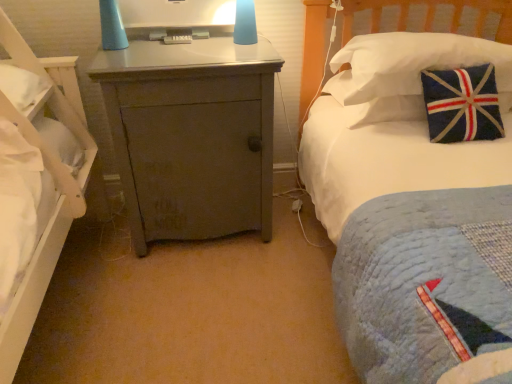
What is the approximate height of matte gray cabinet at center?

matte gray cabinet at center is 31.92 inches tall.

What do you see at coordinates (409, 63) in the screenshot? Image resolution: width=512 pixels, height=384 pixels. I see `white fabric pillow at upper right` at bounding box center [409, 63].

What are the coordinates of `matte plastic monitor at center` in the screenshot? It's located at (177, 18).

The height and width of the screenshot is (384, 512). Find the location of `matte gray cabinet at center`. matte gray cabinet at center is located at coordinates (192, 136).

Is matte plastic monitor at center inside or outside of white fabric pillow at upper right?

matte plastic monitor at center is not enclosed by white fabric pillow at upper right.

From the image's perspective, which is above, matte plastic monitor at center or white fabric pillow at upper right?

matte plastic monitor at center appears higher in the image.

Considering the relative sizes of matte plastic monitor at center and white fabric pillow at upper right in the image provided, is matte plastic monitor at center smaller than white fabric pillow at upper right?

Yes.

Considering the positions of point (185, 8) and point (499, 81), is point (185, 8) closer or farther from the camera than point (499, 81)?

Point (185, 8) is positioned farther from the camera compared to point (499, 81).

Is point (370, 54) behind point (190, 8)?

No.

Identify the location of pillow below the matte plastic monitor at center (from the image's perspective). (409, 63).

From a real-world perspective, is white fabric pillow at upper right under matte plastic monitor at center?

Yes, from a real-world perspective, white fabric pillow at upper right is beneath matte plastic monitor at center.

Is white fabric pillow at upper right completely or partially outside of matte plastic monitor at center?

Yes, white fabric pillow at upper right is outside of matte plastic monitor at center.

From the picture: Considering the relative sizes of matte plastic monitor at center and matte gray cabinet at center in the image provided, is matte plastic monitor at center shorter than matte gray cabinet at center?

Indeed, matte plastic monitor at center has a lesser height compared to matte gray cabinet at center.

Considering the sizes of matte plastic monitor at center and matte gray cabinet at center in the image, is matte plastic monitor at center bigger or smaller than matte gray cabinet at center?

matte plastic monitor at center is smaller than matte gray cabinet at center.

Is matte plastic monitor at center inside the boundaries of matte gray cabinet at center, or outside?

matte plastic monitor at center cannot be found inside matte gray cabinet at center.

Could you tell me if matte plastic monitor at center is turned towards matte gray cabinet at center?

No, matte plastic monitor at center is not oriented towards matte gray cabinet at center.

Is matte gray cabinet at center aimed at matte plastic monitor at center?

No, matte gray cabinet at center is not facing towards matte plastic monitor at center.

Which is behind, matte gray cabinet at center or matte plastic monitor at center?

Positioned behind is matte plastic monitor at center.

From the image's perspective, is matte gray cabinet at center above or below matte plastic monitor at center?

matte gray cabinet at center is below matte plastic monitor at center.

Considering the sizes of matte gray cabinet at center and matte plastic monitor at center in the image, is matte gray cabinet at center wider or thinner than matte plastic monitor at center?

matte gray cabinet at center is wider than matte plastic monitor at center.

Which is behind, white fabric pillow at upper right or matte gray cabinet at center?

Positioned behind is white fabric pillow at upper right.

From the image's perspective, which is below, white fabric pillow at upper right or matte gray cabinet at center?

matte gray cabinet at center, from the image's perspective.

What's the angular difference between white fabric pillow at upper right and matte gray cabinet at center's facing directions?

They differ by 1.62 degrees in their facing directions.

Can you confirm if white fabric pillow at upper right is wider than matte gray cabinet at center?

In fact, white fabric pillow at upper right might be narrower than matte gray cabinet at center.

Is matte gray cabinet at center next to white fabric pillow at upper right and touching it?

No, matte gray cabinet at center is not in contact with white fabric pillow at upper right.

From the image's perspective, which object appears higher, matte gray cabinet at center or white fabric pillow at upper right?

white fabric pillow at upper right.

From a real-world perspective, who is located higher, matte gray cabinet at center or white fabric pillow at upper right?

In real-world perspective, white fabric pillow at upper right is above.

The width and height of the screenshot is (512, 384). Identify the location of pillow below the matte plastic monitor at center (from the image's perspective). (409, 63).

This screenshot has height=384, width=512. I want to click on computer monitor behind the white fabric pillow at upper right, so click(x=177, y=18).

Based on their spatial positions, is matte plastic monitor at center or white fabric pillow at upper right further from matte gray cabinet at center?

Among the two, white fabric pillow at upper right is located further to matte gray cabinet at center.

Estimate the real-world distances between objects in this image. Which object is closer to matte plastic monitor at center, white fabric pillow at upper right or matte gray cabinet at center?

matte gray cabinet at center lies closer to matte plastic monitor at center than the other object.

When comparing their distances from white fabric pillow at upper right, does matte gray cabinet at center or matte plastic monitor at center seem further?

Based on the image, matte plastic monitor at center appears to be further to white fabric pillow at upper right.

Considering their positions, is matte gray cabinet at center positioned closer to matte plastic monitor at center than white fabric pillow at upper right?

matte gray cabinet at center is closer to matte plastic monitor at center.

Which object lies nearer to the anchor point matte gray cabinet at center, white fabric pillow at upper right or matte plastic monitor at center?

Based on the image, matte plastic monitor at center appears to be nearer to matte gray cabinet at center.

Based on their spatial positions, is matte plastic monitor at center or matte gray cabinet at center closer to white fabric pillow at upper right?

matte gray cabinet at center lies closer to white fabric pillow at upper right than the other object.

The image size is (512, 384). I want to click on nightstand situated between matte plastic monitor at center and white fabric pillow at upper right from left to right, so click(x=192, y=136).